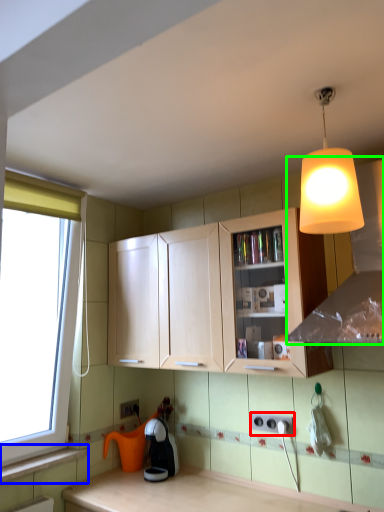
Question: Considering the real-world distances, which object is farthest from electric outlet (highlighted by a red box)? window sill (highlighted by a blue box) or exhaust hood (highlighted by a green box)?

Choices:
 (A) window sill
 (B) exhaust hood

Answer: (A)